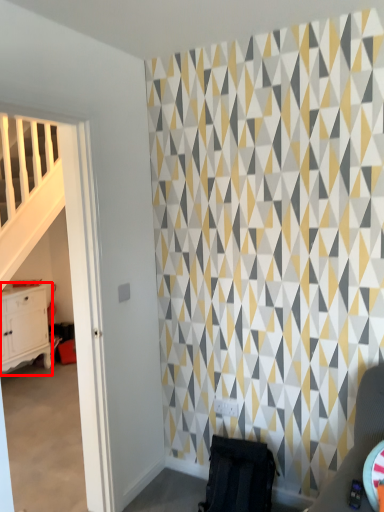
Question: From the image's perspective, where is chest of drawers (annotated by the red box) located relative to swivel chair?

Choices:
 (A) below
 (B) above

Answer: (B)